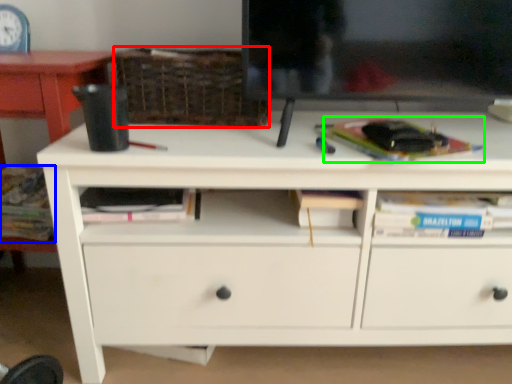
Question: Which object is positioned closest to basket (highlighted by a red box)? Select from book (highlighted by a blue box) and paperback book (highlighted by a green box).

Choices:
 (A) book
 (B) paperback book

Answer: (B)